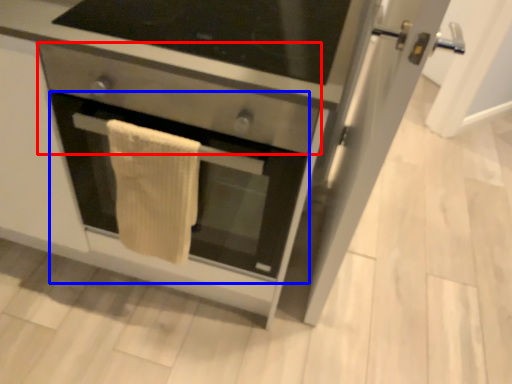
Question: Which of the following is the closest to the observer, drawer (highlighted by a red box) or oven (highlighted by a blue box)?

Choices:
 (A) drawer
 (B) oven

Answer: (A)